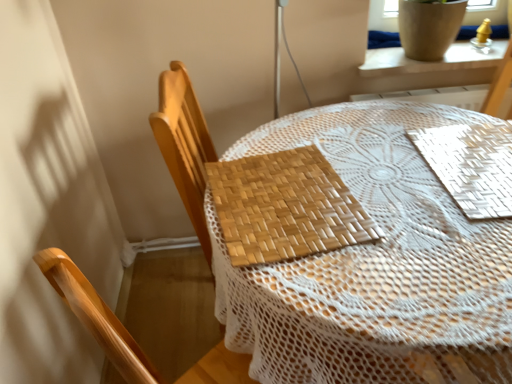
Where is `vacant area located to the right-hand side of woven wood placemat at center, the 2th mat positioned from the right`? The height and width of the screenshot is (384, 512). vacant area located to the right-hand side of woven wood placemat at center, the 2th mat positioned from the right is located at coordinates (404, 193).